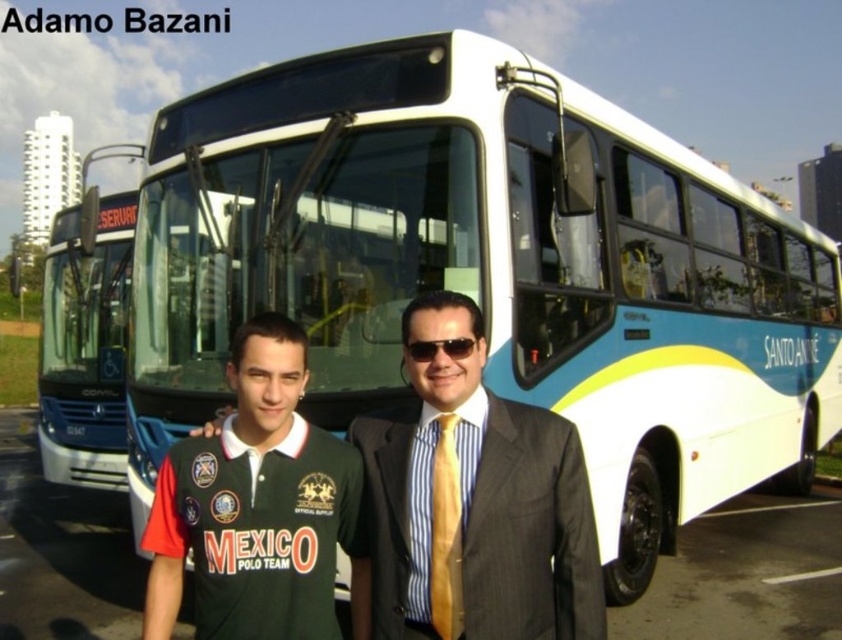
Question: Is green jersey at center below white glossy bus at center?

Choices:
 (A) yes
 (B) no

Answer: (B)

Question: Which object is positioned closest to the white glossy bus at center?

Choices:
 (A) dark gray pinstripe suit at center
 (B) yellow striped tie at center
 (C) green jersey at center

Answer: (C)

Question: Does dark gray pinstripe suit at center appear on the left side of white glossy bus at center?

Choices:
 (A) yes
 (B) no

Answer: (B)

Question: Estimate the real-world distances between objects in this image. Which object is closer to the green jersey at center?

Choices:
 (A) dark gray pinstripe suit at center
 (B) white glossy bus at center
 (C) sunglasses at center
 (D) yellow striped tie at center

Answer: (A)

Question: Which of the following is the closest to the observer?

Choices:
 (A) white glossy bus at center
 (B) sunglasses at center
 (C) green jersey at center

Answer: (C)

Question: Is white glossy bus at center smaller than yellow striped tie at center?

Choices:
 (A) yes
 (B) no

Answer: (B)